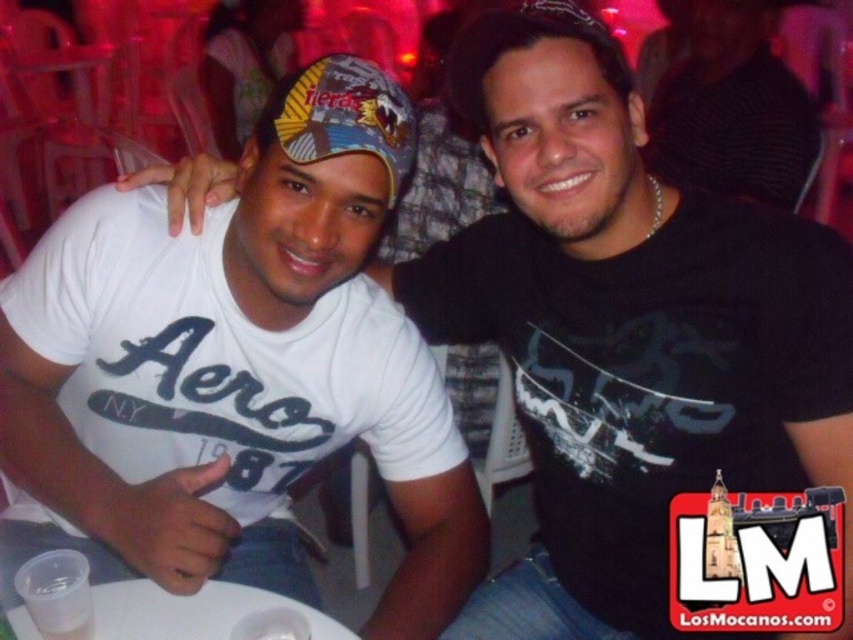
Question: Which is nearer to the white matte t-shirt at left?

Choices:
 (A) black knit cap at upper center
 (B) multicolored fabric baseball cap at center
 (C) white plastic table at lower center

Answer: (C)

Question: Is black knit cap at upper center wider than white plastic table at lower center?

Choices:
 (A) yes
 (B) no

Answer: (A)

Question: Is black knit cap at upper center wider than white plastic table at lower center?

Choices:
 (A) no
 (B) yes

Answer: (B)

Question: Estimate the real-world distances between objects in this image. Which object is closer to the white matte t-shirt at left?

Choices:
 (A) black knit cap at upper center
 (B) multicolored fabric baseball cap at center

Answer: (B)

Question: Estimate the real-world distances between objects in this image. Which object is farther from the white plastic table at lower center?

Choices:
 (A) multicolored fabric baseball cap at center
 (B) white matte t-shirt at left
 (C) black knit cap at upper center

Answer: (C)

Question: Is white matte t-shirt at left below white plastic table at lower center?

Choices:
 (A) yes
 (B) no

Answer: (B)